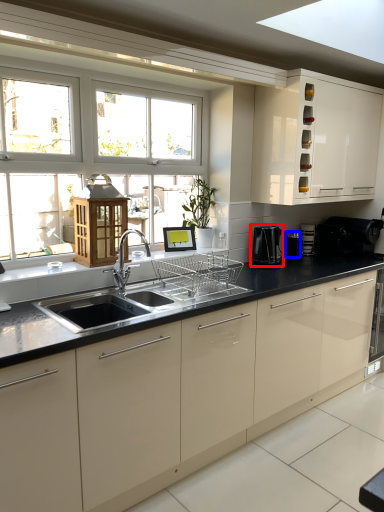
Question: Which object is closer to the camera taking this photo, coffee machine (highlighted by a red box) or appliance (highlighted by a blue box)?

Choices:
 (A) coffee machine
 (B) appliance

Answer: (A)